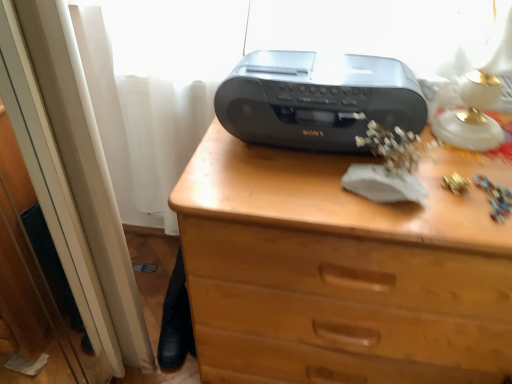
The image size is (512, 384). Identify the location of white glossy table lamp at upper right. (479, 96).

What do you see at coordinates (317, 99) in the screenshot?
I see `satin black radio at center` at bounding box center [317, 99].

Identify the location of brown wooden chest of drawers at center. Image resolution: width=512 pixels, height=384 pixels. (341, 271).

Considering the positions of objects brown wooden chest of drawers at center and white glossy table lamp at upper right in the image provided, who is more to the right, brown wooden chest of drawers at center or white glossy table lamp at upper right?

From the viewer's perspective, white glossy table lamp at upper right appears more on the right side.

From a real-world perspective, who is located higher, brown wooden chest of drawers at center or white glossy table lamp at upper right?

white glossy table lamp at upper right.

Does brown wooden chest of drawers at center have a smaller size compared to white glossy table lamp at upper right?

Actually, brown wooden chest of drawers at center might be larger than white glossy table lamp at upper right.

Are brown wooden chest of drawers at center and white glossy table lamp at upper right beside each other?

There is a gap between brown wooden chest of drawers at center and white glossy table lamp at upper right.

From the image's perspective, which is below, satin black radio at center or brown wooden chest of drawers at center?

brown wooden chest of drawers at center is shown below in the image.

Who is smaller, satin black radio at center or brown wooden chest of drawers at center?

satin black radio at center.

Is satin black radio at center to the left or to the right of brown wooden chest of drawers at center in the image?

Based on their positions, satin black radio at center is located to the left of brown wooden chest of drawers at center.

Can you confirm if brown wooden chest of drawers at center is thinner than satin black radio at center?

In fact, brown wooden chest of drawers at center might be wider than satin black radio at center.

Is brown wooden chest of drawers at center in front of satin black radio at center?

Yes.

From the image's perspective, between brown wooden chest of drawers at center and satin black radio at center, who is located below?

brown wooden chest of drawers at center.

In the scene shown: Is the surface of brown wooden chest of drawers at center in direct contact with satin black radio at center?

No, brown wooden chest of drawers at center is not touching satin black radio at center.

Between white glossy table lamp at upper right and satin black radio at center, which one is positioned behind?

satin black radio at center is behind.

Is white glossy table lamp at upper right thinner than satin black radio at center?

Yes.

Is white glossy table lamp at upper right placed right next to satin black radio at center?

No, white glossy table lamp at upper right is not in contact with satin black radio at center.

Which is more to the left, white glossy table lamp at upper right or satin black radio at center?

From the viewer's perspective, satin black radio at center appears more on the left side.

Considering the relative sizes of white glossy table lamp at upper right and brown wooden chest of drawers at center in the image provided, is white glossy table lamp at upper right thinner than brown wooden chest of drawers at center?

Indeed, white glossy table lamp at upper right has a lesser width compared to brown wooden chest of drawers at center.

From a real-world perspective, is white glossy table lamp at upper right physically above brown wooden chest of drawers at center?

Correct, in the physical world, white glossy table lamp at upper right is higher than brown wooden chest of drawers at center.

Is white glossy table lamp at upper right looking in the opposite direction of brown wooden chest of drawers at center?

No, white glossy table lamp at upper right is not facing the opposite direction of brown wooden chest of drawers at center.

How much distance is there between white glossy table lamp at upper right and brown wooden chest of drawers at center?

white glossy table lamp at upper right is 12.36 inches away from brown wooden chest of drawers at center.

Consider the image. Are satin black radio at center and white glossy table lamp at upper right making contact?

No, satin black radio at center is not touching white glossy table lamp at upper right.

From a real-world perspective, between satin black radio at center and white glossy table lamp at upper right, who is vertically higher?

In real-world perspective, white glossy table lamp at upper right is above.

Is satin black radio at center facing away from white glossy table lamp at upper right?

No, white glossy table lamp at upper right is not at the back of satin black radio at center.

Is satin black radio at center taller than white glossy table lamp at upper right?

No, satin black radio at center is not taller than white glossy table lamp at upper right.

The image size is (512, 384). I want to click on chest of drawers located on the left of white glossy table lamp at upper right, so click(341, 271).

Locate an element on the screen. This screenshot has height=384, width=512. printer that appears above the brown wooden chest of drawers at center (from a real-world perspective) is located at coordinates (317, 99).

Based on their spatial positions, is satin black radio at center or white glossy table lamp at upper right closer to brown wooden chest of drawers at center?

satin black radio at center is positioned closer to the anchor brown wooden chest of drawers at center.

Estimate the real-world distances between objects in this image. Which object is further from satin black radio at center, white glossy table lamp at upper right or brown wooden chest of drawers at center?

Among the two, white glossy table lamp at upper right is located further to satin black radio at center.

From the image, which object appears to be farther from white glossy table lamp at upper right, brown wooden chest of drawers at center or satin black radio at center?

brown wooden chest of drawers at center.

Based on their spatial positions, is satin black radio at center or brown wooden chest of drawers at center closer to white glossy table lamp at upper right?

satin black radio at center.

Considering their positions, is white glossy table lamp at upper right positioned closer to brown wooden chest of drawers at center than satin black radio at center?

satin black radio at center.

Which object lies nearer to the anchor point satin black radio at center, brown wooden chest of drawers at center or white glossy table lamp at upper right?

The object closer to satin black radio at center is brown wooden chest of drawers at center.

You are a GUI agent. You are given a task and a screenshot of the screen. Output one action in this format:
    pyautogui.click(x=<x>, y=<y>)
    Task: Click on the printer between white glossy table lamp at upper right and brown wooden chest of drawers at center in the up-down direction
    
    Given the screenshot: What is the action you would take?
    pyautogui.click(x=317, y=99)